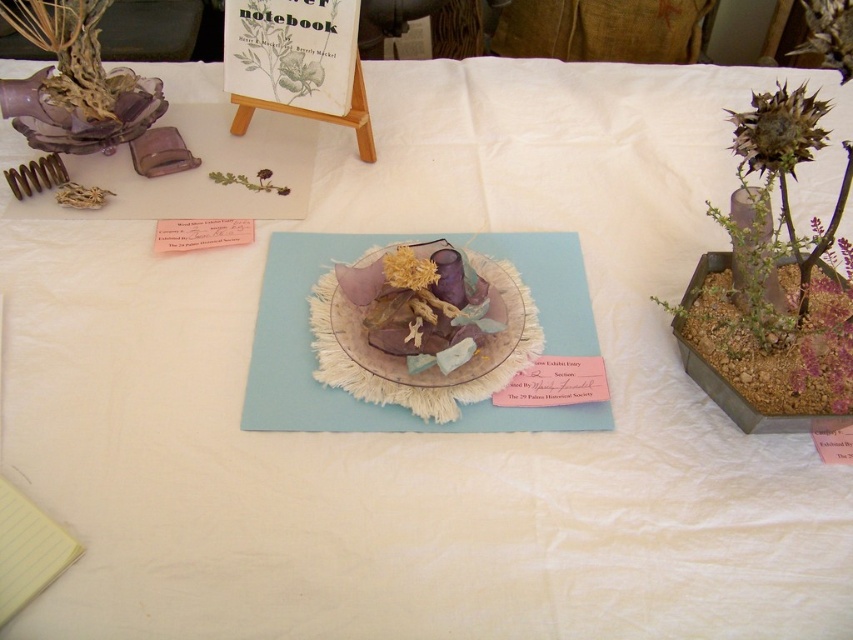
Question: Which object appears farthest from the camera in this image?

Choices:
 (A) fuzzy golden flower at center
 (B) brown spiky plant at right

Answer: (A)

Question: Which object is the farthest from the brown spiky plant at right?

Choices:
 (A) fuzzy golden flower at center
 (B) brown textured flower at upper right

Answer: (A)

Question: Among these points, which one is farthest from the camera?

Choices:
 (A) (722, 268)
 (B) (224, 177)
 (C) (424, 280)

Answer: (B)

Question: Can you confirm if fuzzy golden flower at center is positioned to the right of green matte plant at center?

Choices:
 (A) no
 (B) yes

Answer: (B)

Question: Is brown textured flower at upper right further to the viewer compared to brown spiky plant at right?

Choices:
 (A) no
 (B) yes

Answer: (A)

Question: Is brown spiky plant at right thinner than green matte plant at center?

Choices:
 (A) yes
 (B) no

Answer: (B)